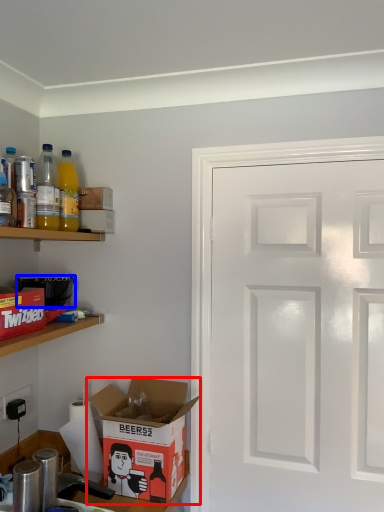
Question: Which point is closer to the camera, box (highlighted by a red box) or appliance (highlighted by a blue box)?

Choices:
 (A) box
 (B) appliance

Answer: (A)